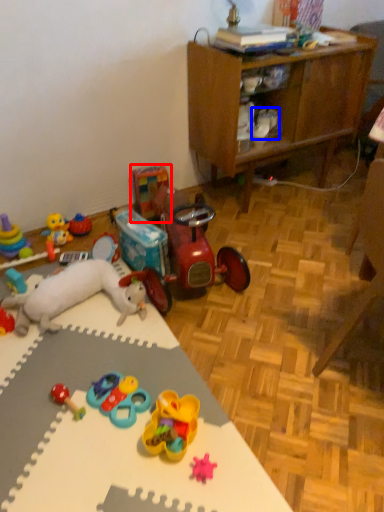
Question: Which object appears farthest to the camera in this image, toy (highlighted by a red box) or footwear (highlighted by a blue box)?

Choices:
 (A) toy
 (B) footwear

Answer: (A)